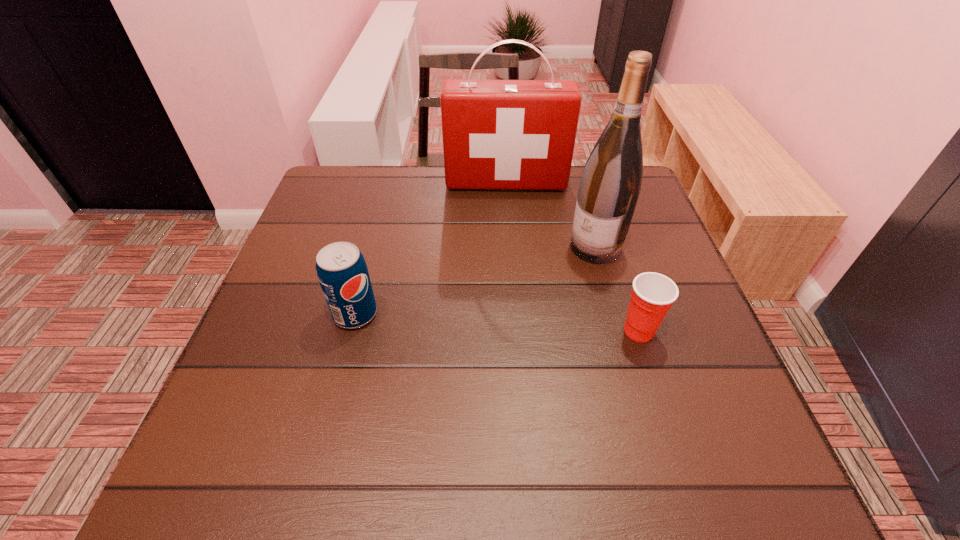
Where is `free space at the left edge of the desktop`? The height and width of the screenshot is (540, 960). free space at the left edge of the desktop is located at coordinates (311, 270).

Locate an element on the screen. vacant space at the right edge is located at coordinates (726, 372).

In order to click on vacant space at the far left corner in this screenshot , I will do point(365,212).

You are a GUI agent. You are given a task and a screenshot of the screen. Output one action in this format:
    pyautogui.click(x=<x>, y=<y>)
    Task: Click on the free space at the near left corner of the desktop
    The width and height of the screenshot is (960, 540).
    Given the screenshot: What is the action you would take?
    pyautogui.click(x=212, y=417)

Locate an element on the screen. vacant point located between the third nearest object and the shortest object is located at coordinates [x=617, y=289].

Locate an element on the screen. The width and height of the screenshot is (960, 540). vacant space in between the Dixie cup and the second tallest object is located at coordinates (572, 257).

Where is `free point between the first-aid kit and the pop`? Image resolution: width=960 pixels, height=540 pixels. free point between the first-aid kit and the pop is located at coordinates (431, 248).

Locate an element on the screen. unoccupied position between the leftmost object and the wine bottle is located at coordinates (475, 281).

You are a GUI agent. You are given a task and a screenshot of the screen. Output one action in this format:
    pyautogui.click(x=<x>, y=<y>)
    Task: Click on the empty location between the pop and the Dixie cup
    This screenshot has width=960, height=540.
    Given the screenshot: What is the action you would take?
    pyautogui.click(x=497, y=322)

Where is `vacant region between the farthest object and the shortest object`? vacant region between the farthest object and the shortest object is located at coordinates (572, 257).